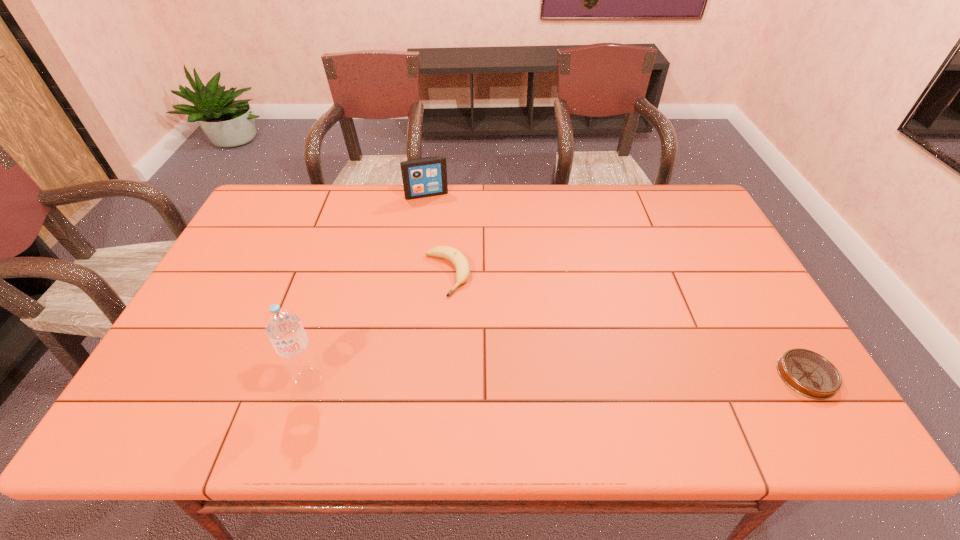
Locate an element on the screen. The width and height of the screenshot is (960, 540). vacant space on the desktop that is between the water bottle and the compass and is positioned at the stem of the third tallest object is located at coordinates pyautogui.click(x=514, y=378).

Where is `vacant space on the desktop that is between the leftmost object and the shortest object and is positioned on the front screen of the iPod`? vacant space on the desktop that is between the leftmost object and the shortest object and is positioned on the front screen of the iPod is located at coordinates (484, 378).